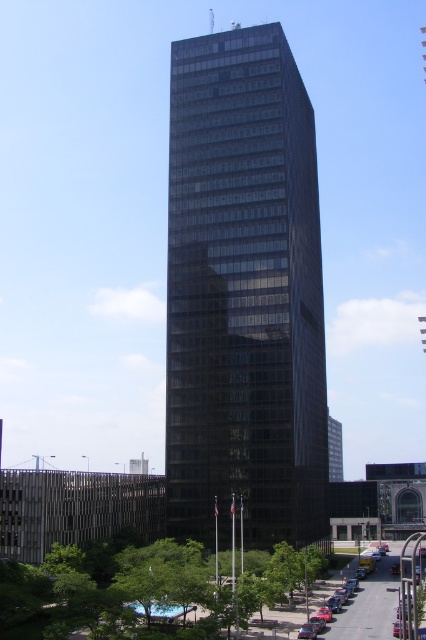
Who is positioned more to the left, dark glass skyscraper at center or metallic silver sedan at lower right?

From the viewer's perspective, dark glass skyscraper at center appears more on the left side.

Is point (265, 257) in front of point (382, 634)?

No, it is not.

Which is behind, point (210, 499) or point (389, 605)?

The point (210, 499) is more distant.

I want to click on dark glass skyscraper at center, so click(x=244, y=294).